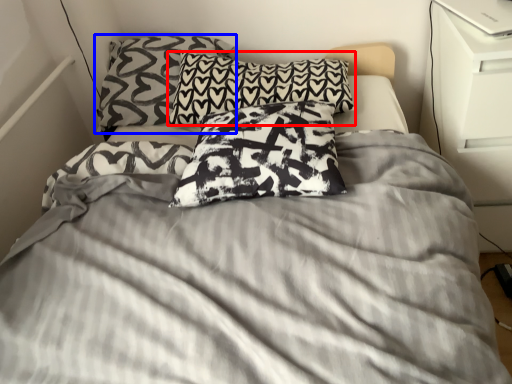
Question: Which object is further to the camera taking this photo, pillow (highlighted by a red box) or pillow (highlighted by a blue box)?

Choices:
 (A) pillow
 (B) pillow

Answer: (B)